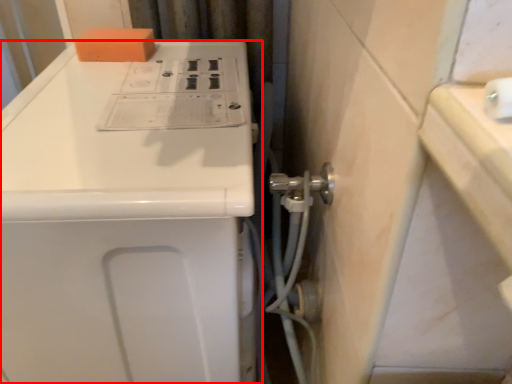
Question: In this image, where is home appliance (annotated by the red box) located relative to soap?

Choices:
 (A) left
 (B) right

Answer: (B)